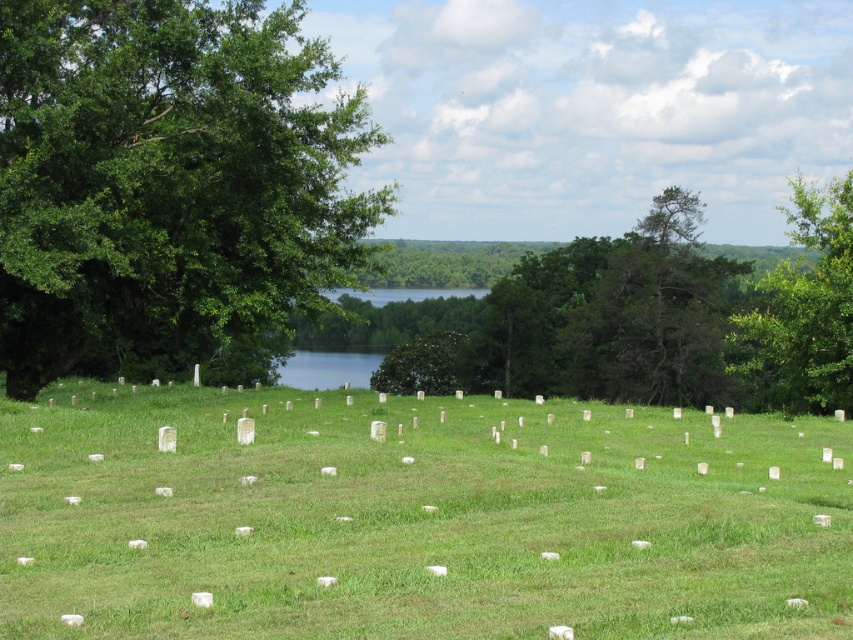
Question: Does green grass at center appear on the left side of green leafy tree at upper right?

Choices:
 (A) yes
 (B) no

Answer: (A)

Question: Which of the following is the closest to the observer?

Choices:
 (A) green grass at center
 (B) green leafy tree at left
 (C) green leafy tree at upper right

Answer: (A)

Question: Which point is farther to the camera?

Choices:
 (A) click(584, 630)
 (B) click(756, 291)

Answer: (B)

Question: Is the position of green grass at center less distant than that of green leafy tree at left?

Choices:
 (A) yes
 (B) no

Answer: (A)

Question: Based on their relative distances, which object is nearer to the green leafy tree at left?

Choices:
 (A) green leafy tree at upper right
 (B) green grass at center

Answer: (B)

Question: Is green grass at center positioned in front of green leafy tree at left?

Choices:
 (A) no
 (B) yes

Answer: (B)